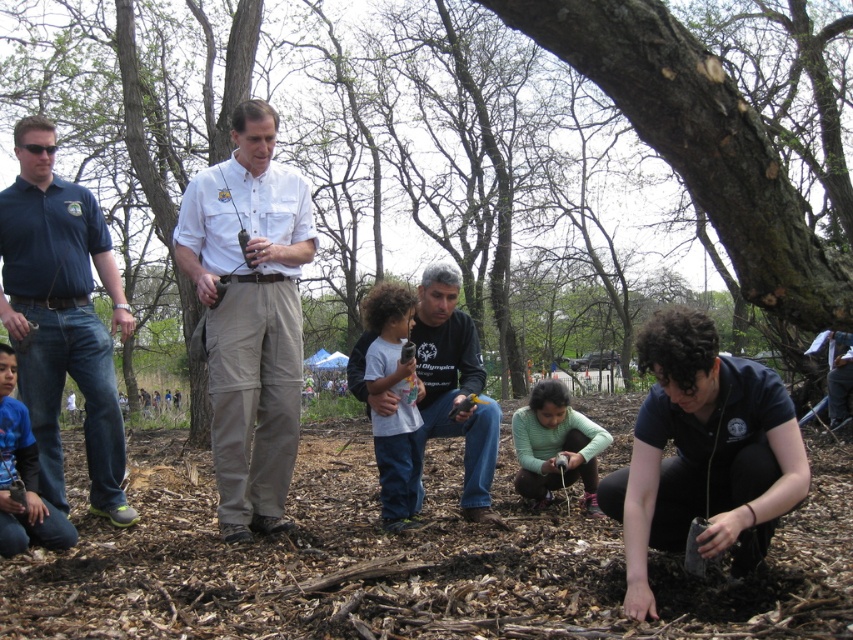
Who is positioned more to the right, rough bark tree at center or blue denim jeans at lower left?

From the viewer's perspective, blue denim jeans at lower left appears more on the right side.

Can you confirm if rough bark tree at center is positioned to the right of blue denim jeans at lower left?

No, rough bark tree at center is not to the right of blue denim jeans at lower left.

Does point (486, 106) come behind point (9, 412)?

Yes, it is behind point (9, 412).

Locate an element on the screen. rough bark tree at center is located at coordinates (486, 145).

Which is more to the left, dark blue shirt at lower right or dark gray shirt at center?

Positioned to the left is dark gray shirt at center.

Is point (735, 560) positioned after point (471, 486)?

No.

Does point (642, 573) lie in front of point (457, 346)?

Yes, it is in front of point (457, 346).

The width and height of the screenshot is (853, 640). What are the coordinates of `dark blue shirt at lower right` in the screenshot? It's located at (703, 452).

Measure the distance between white cotton shirt at center and dark gray shirt at center.

white cotton shirt at center is 4.51 feet away from dark gray shirt at center.

Does white cotton shirt at center have a lesser width compared to dark gray shirt at center?

Incorrect, white cotton shirt at center's width is not less than dark gray shirt at center's.

Find the location of a particular element. This screenshot has width=853, height=640. white cotton shirt at center is located at coordinates (250, 316).

Where is `white cotton shirt at center`? white cotton shirt at center is located at coordinates (250, 316).